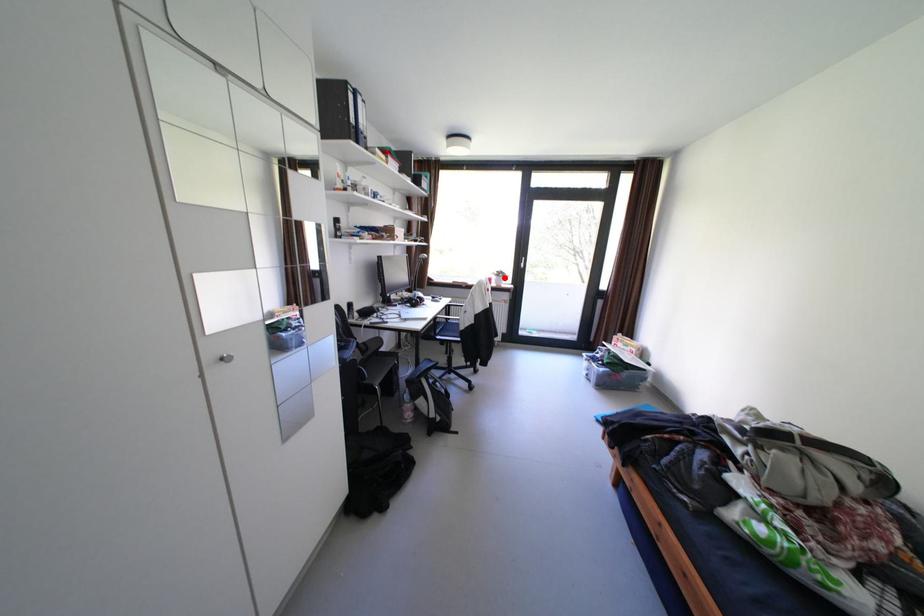
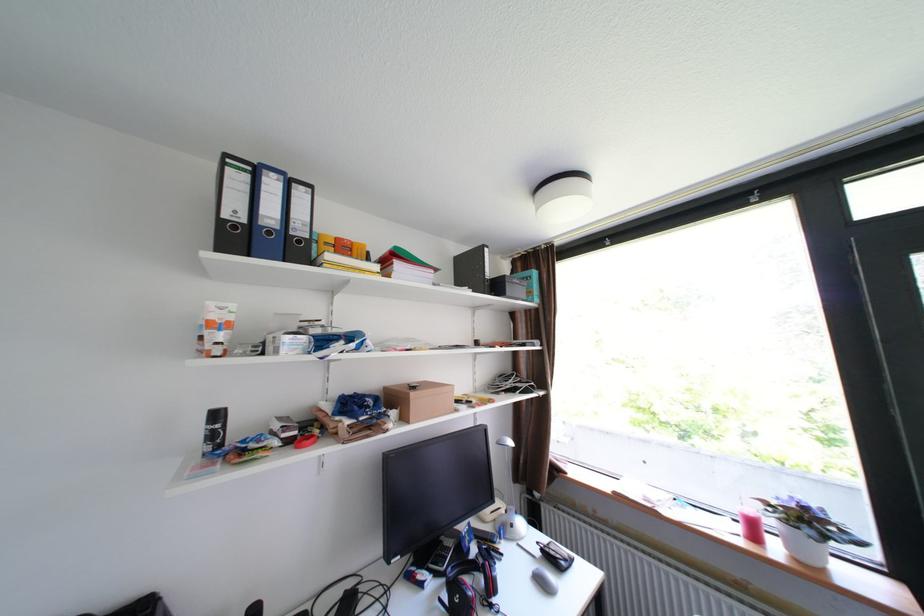
Find the pixel in the second image that matches the highlighted location in the first image.

(782, 523)